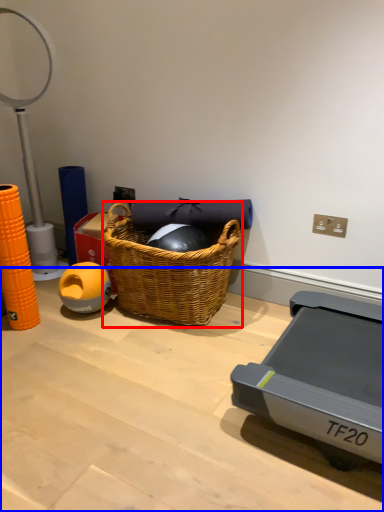
Question: Which of the following is the farthest to the observer, picnic basket (highlighted by a red box) or table (highlighted by a blue box)?

Choices:
 (A) picnic basket
 (B) table

Answer: (A)